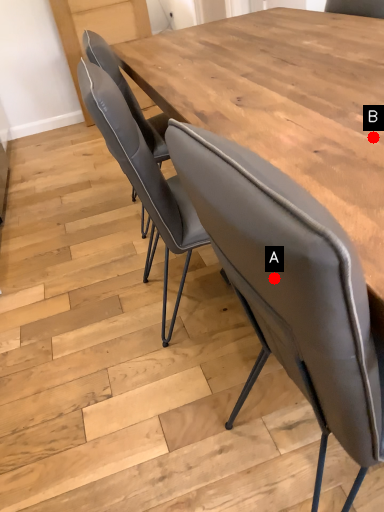
Question: Two points are circled on the image, labeled by A and B beside each circle. Which point is closer to the camera?

Choices:
 (A) A is closer
 (B) B is closer

Answer: (A)